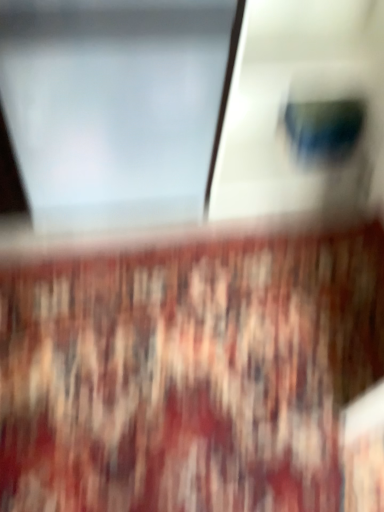
What is the approximate width of carpeted mat at center?

carpeted mat at center is 34.44 inches in width.

I want to click on carpeted mat at center, so click(x=187, y=372).

What do you see at coordinates (187, 372) in the screenshot? I see `carpeted mat at center` at bounding box center [187, 372].

You are a GUI agent. You are given a task and a screenshot of the screen. Output one action in this format:
    pyautogui.click(x=<x>, y=<y>)
    Task: Click on the carpeted mat at center
    The image size is (384, 512).
    Given the screenshot: What is the action you would take?
    pyautogui.click(x=187, y=372)